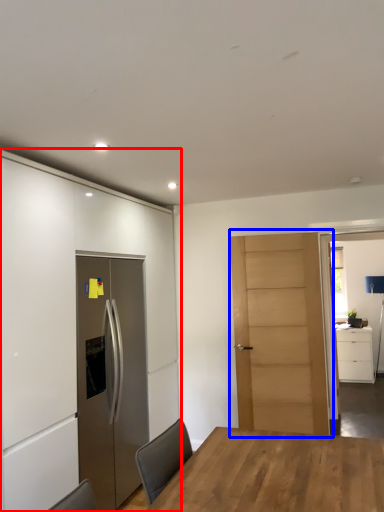
Question: Among these objects, which one is farthest to the camera, cabinetry (highlighted by a red box) or door (highlighted by a blue box)?

Choices:
 (A) cabinetry
 (B) door

Answer: (B)